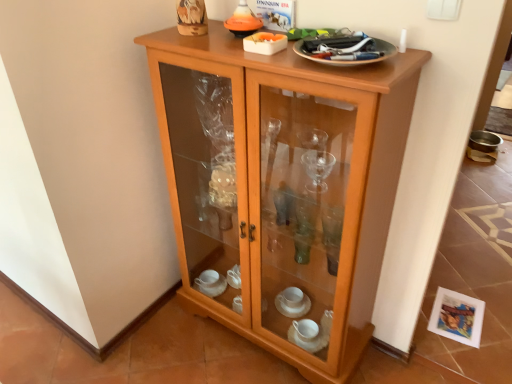
I want to click on free location above metallic silver plate at upper right (from a real-world perspective), so click(x=337, y=39).